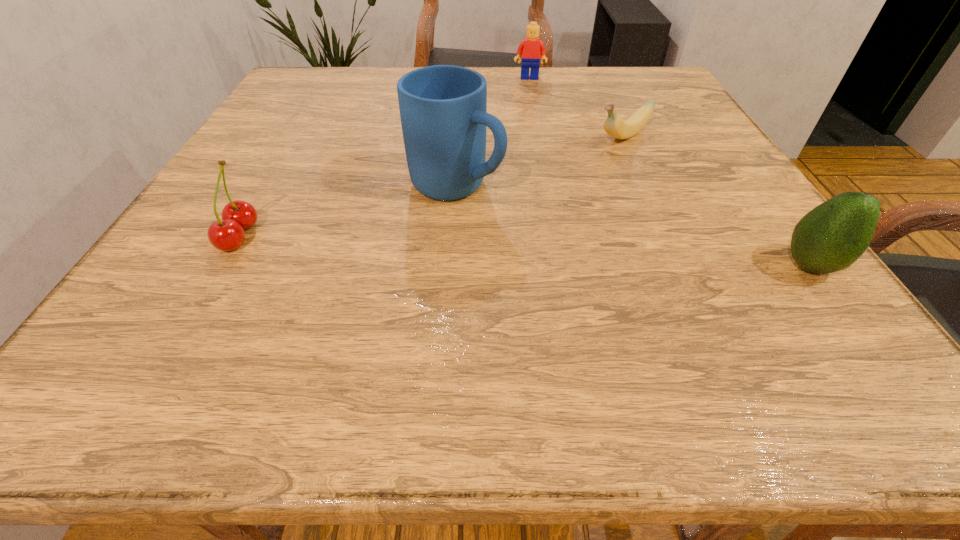
Find the location of a particular element. the leftmost object is located at coordinates (226, 235).

Image resolution: width=960 pixels, height=540 pixels. Find the location of `the rightmost object`. the rightmost object is located at coordinates (832, 236).

Locate an element on the screen. The image size is (960, 540). the farthest object is located at coordinates (530, 49).

You are a GUI agent. You are given a task and a screenshot of the screen. Output one action in this format:
    pyautogui.click(x=<x>, y=<y>)
    Task: Click on the Lego
    
    Given the screenshot: What is the action you would take?
    pyautogui.click(x=530, y=49)

Find the location of a particular element. This screenshot has width=960, height=540. the tallest object is located at coordinates (443, 108).

Image resolution: width=960 pixels, height=540 pixels. I want to click on the fourth object from right to left, so click(443, 108).

Where is `the second farthest object`? the second farthest object is located at coordinates (613, 125).

Where is `the fourth object from left to right`? This screenshot has height=540, width=960. the fourth object from left to right is located at coordinates (613, 125).

Where is `vacant space located 0.050m with the stems of the leftmost object pointing upwards`? The width and height of the screenshot is (960, 540). vacant space located 0.050m with the stems of the leftmost object pointing upwards is located at coordinates click(x=191, y=236).

At what (x,y) coordinates should I click in order to perform the action: click on vacant area situated on the back of the avocado. Please return your answer as a coordinate pair (x, y). This screenshot has width=960, height=540. Looking at the image, I should click on [756, 194].